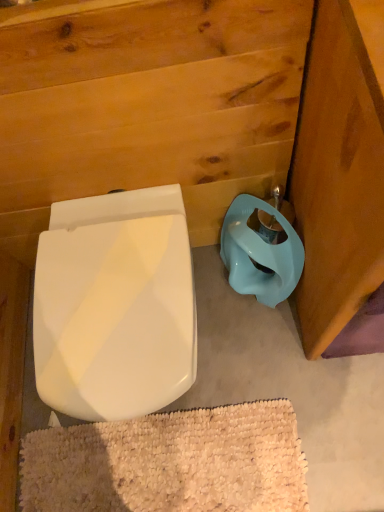
Question: Is the depth of white glossy toilet seat at lower left less than that of white textured bath mat at lower center?

Choices:
 (A) yes
 (B) no

Answer: (A)

Question: Can you confirm if white glossy toilet seat at lower left is shorter than white textured bath mat at lower center?

Choices:
 (A) no
 (B) yes

Answer: (A)

Question: Is white glossy toilet seat at lower left touching white textured bath mat at lower center?

Choices:
 (A) yes
 (B) no

Answer: (B)

Question: From a real-world perspective, is white glossy toilet seat at lower left over white textured bath mat at lower center?

Choices:
 (A) no
 (B) yes

Answer: (B)

Question: Does white glossy toilet seat at lower left have a greater width compared to white textured bath mat at lower center?

Choices:
 (A) yes
 (B) no

Answer: (A)

Question: Considering the relative positions of white textured bath mat at lower center and white glossy toilet seat at lower left in the image provided, is white textured bath mat at lower center to the left or to the right of white glossy toilet seat at lower left?

Choices:
 (A) left
 (B) right

Answer: (B)

Question: Is white textured bath mat at lower center bigger or smaller than white glossy toilet seat at lower left?

Choices:
 (A) small
 (B) big

Answer: (A)

Question: Considering the positions of white textured bath mat at lower center and white glossy toilet seat at lower left in the image, is white textured bath mat at lower center wider or thinner than white glossy toilet seat at lower left?

Choices:
 (A) thin
 (B) wide

Answer: (A)

Question: From the image's perspective, is white textured bath mat at lower center above or below white glossy toilet seat at lower left?

Choices:
 (A) above
 (B) below

Answer: (B)

Question: Does point (49, 353) appear closer or farther from the camera than point (256, 242)?

Choices:
 (A) closer
 (B) farther

Answer: (A)

Question: Based on their sizes in the image, would you say white glossy toilet seat at lower left is bigger or smaller than matte blue plastic toilet bowl at lower right?

Choices:
 (A) small
 (B) big

Answer: (B)

Question: From the image's perspective, relative to matte blue plastic toilet bowl at lower right, is white glossy toilet seat at lower left above or below?

Choices:
 (A) below
 (B) above

Answer: (A)

Question: Is white glossy toilet seat at lower left in front of or behind matte blue plastic toilet bowl at lower right in the image?

Choices:
 (A) behind
 (B) front

Answer: (B)

Question: Considering their positions, is matte blue plastic toilet bowl at lower right located in front of or behind white glossy toilet seat at lower left?

Choices:
 (A) behind
 (B) front

Answer: (A)

Question: Which is correct: matte blue plastic toilet bowl at lower right is inside white glossy toilet seat at lower left, or outside of it?

Choices:
 (A) outside
 (B) inside

Answer: (A)